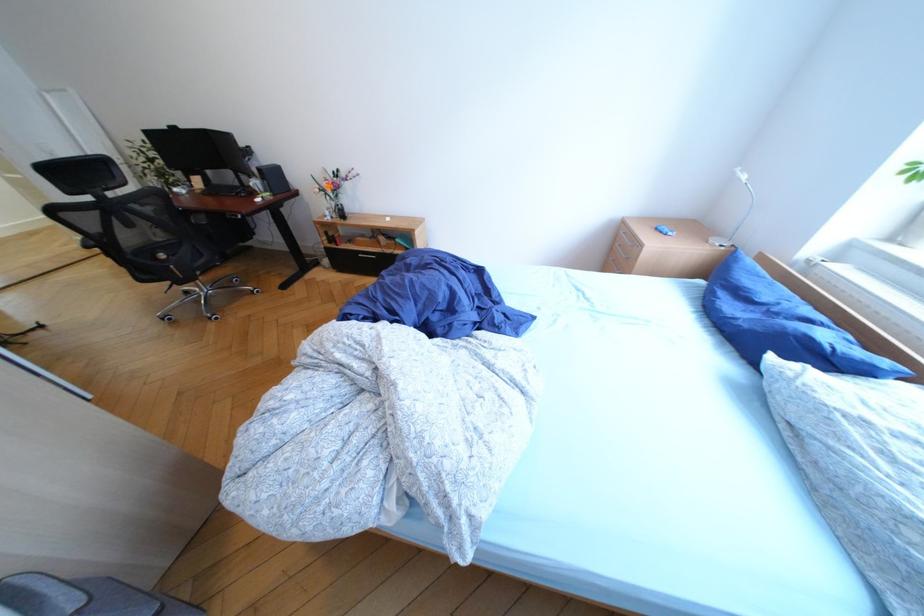
Which object does [333,190] point to?

This point indicates the glass flower vase.